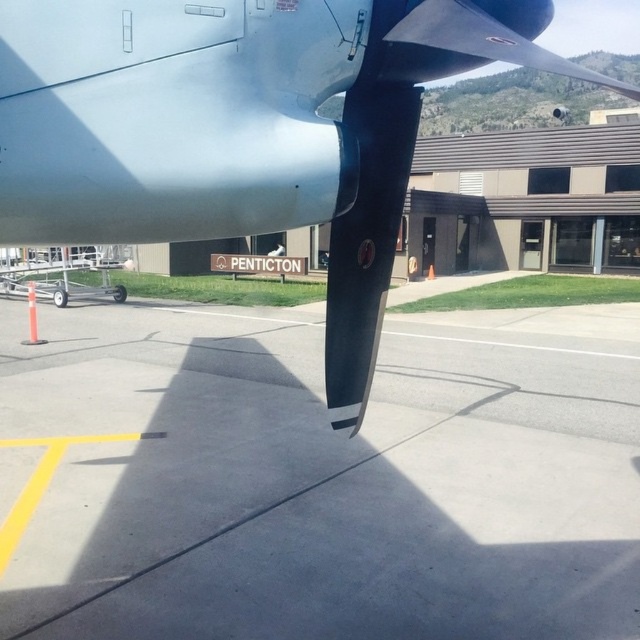
Between gray concrete tarmac at center and polished aluminum propeller at center, which one has less height?

With less height is gray concrete tarmac at center.

Who is higher up, gray concrete tarmac at center or polished aluminum propeller at center?

polished aluminum propeller at center

I want to click on gray concrete tarmac at center, so click(321, 483).